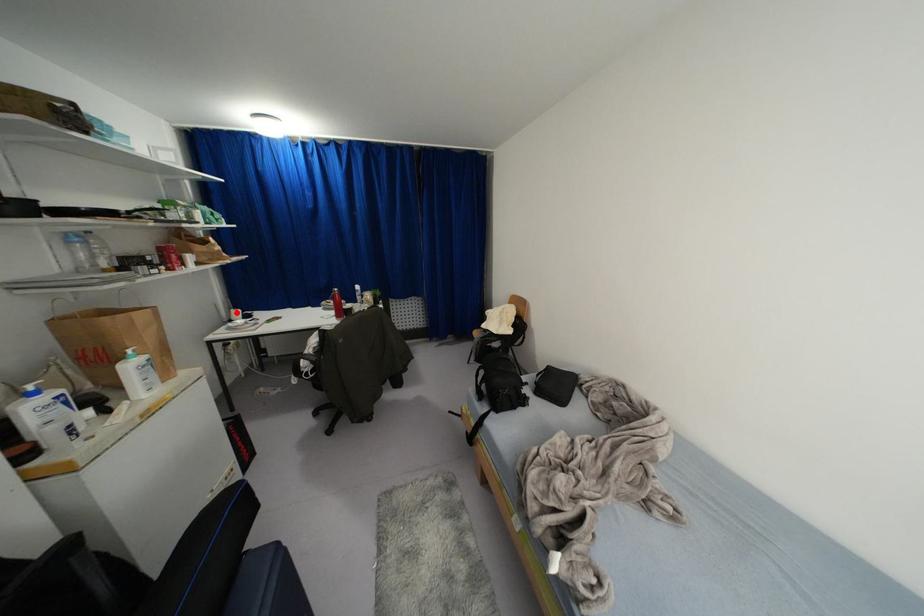
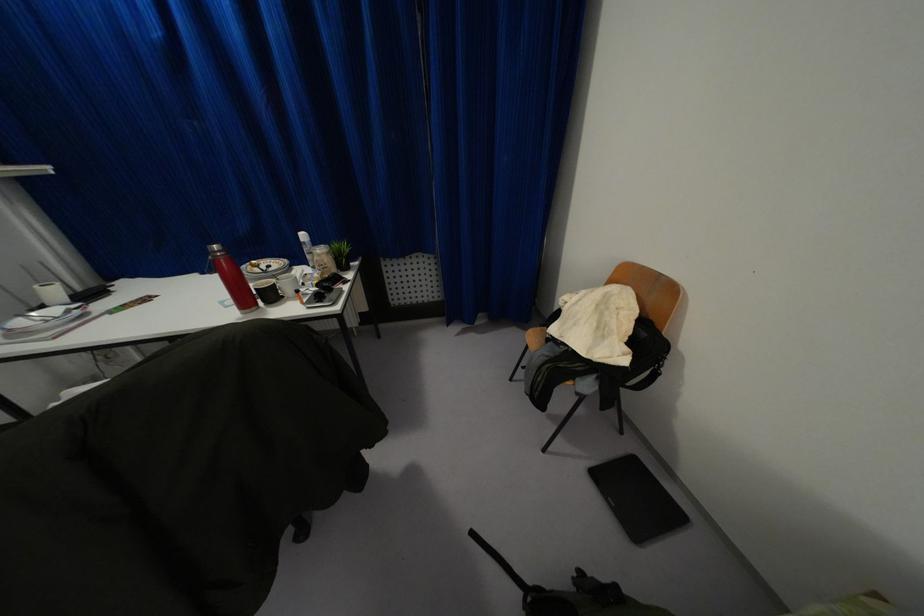
Locate, in the second image, the point that corresponds to the highlighted location in the first image.

(53, 291)